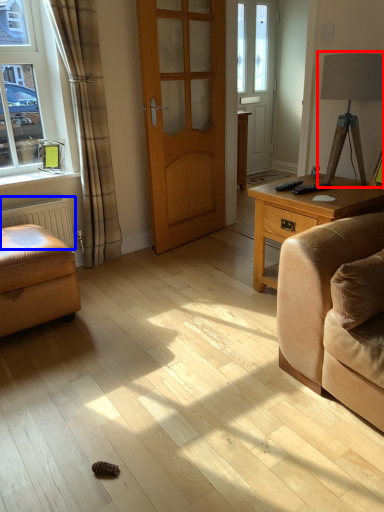
Question: Among these objects, which one is nearest to the camera, table lamp (highlighted by a red box) or radiator (highlighted by a blue box)?

Choices:
 (A) table lamp
 (B) radiator

Answer: (A)